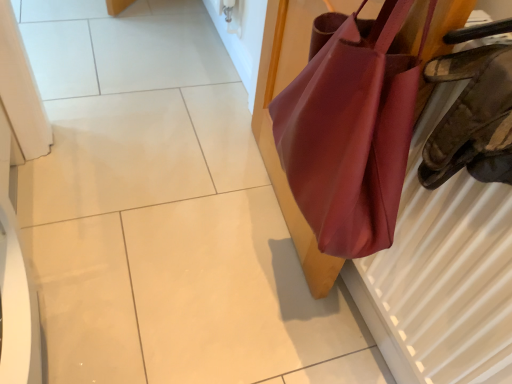
Identify the location of vacant area to the left of matte leather handbag at right. This screenshot has width=512, height=384. (166, 191).